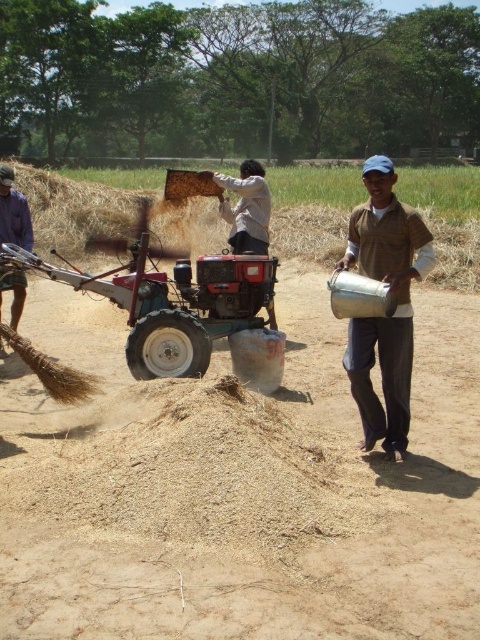
Question: Estimate the real-world distances between objects in this image. Which object is farther from the brushed metal broom at left?

Choices:
 (A) silver metallic bucket at right
 (B) reddish metallic tractor at center
 (C) brown dirt track at center

Answer: (B)

Question: Is brown dirt track at center above brushed metal broom at left?

Choices:
 (A) yes
 (B) no

Answer: (B)

Question: Which point appears farthest from the camera in this image?

Choices:
 (A) (8, 173)
 (B) (350, 376)
 (C) (266, 301)

Answer: (A)

Question: Does brown dirt track at center have a lesser width compared to brushed metal broom at left?

Choices:
 (A) no
 (B) yes

Answer: (A)

Question: Can you confirm if brown dirt track at center is positioned to the left of brushed metal broom at left?

Choices:
 (A) no
 (B) yes

Answer: (A)

Question: Considering the real-world distances, which object is closest to the silver metallic bucket at right?

Choices:
 (A) reddish metallic tractor at center
 (B) brushed metal broom at left

Answer: (B)